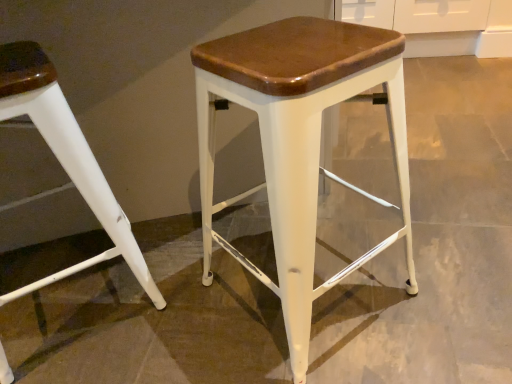
Question: Considering the relative sizes of matte white stool at center, acting as the first stool starting from the right, and white matte stool at left, marked as the second stool in a right-to-left arrangement, in the image provided, is matte white stool at center, acting as the first stool starting from the right, wider than white matte stool at left, marked as the second stool in a right-to-left arrangement,?

Choices:
 (A) no
 (B) yes

Answer: (A)

Question: Is matte white stool at center, acting as the first stool starting from the right, closer to camera compared to white matte stool at left, which is counted as the first stool, starting from the left?

Choices:
 (A) no
 (B) yes

Answer: (B)

Question: Is matte white stool at center, which ranks as the second stool in left-to-right order, to the right of white matte stool at left, which is counted as the first stool, starting from the left, from the viewer's perspective?

Choices:
 (A) no
 (B) yes

Answer: (B)

Question: Can you confirm if matte white stool at center, acting as the first stool starting from the right, is shorter than white matte stool at left, marked as the second stool in a right-to-left arrangement?

Choices:
 (A) no
 (B) yes

Answer: (A)

Question: Is matte white stool at center, acting as the first stool starting from the right, positioned with its back to white matte stool at left, marked as the second stool in a right-to-left arrangement?

Choices:
 (A) no
 (B) yes

Answer: (A)

Question: Is white matte stool at left, marked as the second stool in a right-to-left arrangement, inside matte white stool at center, acting as the first stool starting from the right?

Choices:
 (A) yes
 (B) no

Answer: (B)

Question: Does white matte stool at left, marked as the second stool in a right-to-left arrangement, have a larger size compared to matte white stool at center, which ranks as the second stool in left-to-right order?

Choices:
 (A) yes
 (B) no

Answer: (A)

Question: Is white matte stool at left, marked as the second stool in a right-to-left arrangement, positioned far away from matte white stool at center, which ranks as the second stool in left-to-right order?

Choices:
 (A) no
 (B) yes

Answer: (A)

Question: Is white matte stool at left, which is counted as the first stool, starting from the left, oriented away from matte white stool at center, acting as the first stool starting from the right?

Choices:
 (A) no
 (B) yes

Answer: (A)

Question: Is white matte stool at left, marked as the second stool in a right-to-left arrangement, facing towards matte white stool at center, acting as the first stool starting from the right?

Choices:
 (A) no
 (B) yes

Answer: (A)

Question: Can you confirm if white matte stool at left, marked as the second stool in a right-to-left arrangement, is shorter than matte white stool at center, acting as the first stool starting from the right?

Choices:
 (A) yes
 (B) no

Answer: (A)

Question: From a real-world perspective, is white matte stool at left, marked as the second stool in a right-to-left arrangement, physically below matte white stool at center, acting as the first stool starting from the right?

Choices:
 (A) yes
 (B) no

Answer: (A)

Question: Relative to white matte stool at left, marked as the second stool in a right-to-left arrangement, is matte white stool at center, which ranks as the second stool in left-to-right order, in front or behind?

Choices:
 (A) behind
 (B) front

Answer: (B)